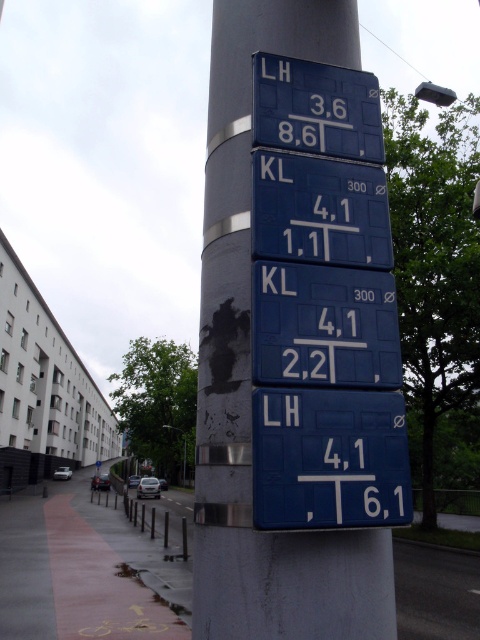
You are a delivery driver who needs to park your truck on the red asphalt pavement at lower left. However, there is a black plastic sign at center nearby. Can you park your truck there without hitting the sign?

The red asphalt pavement at lower left might be wider than black plastic sign at center, so there is a possibility that the truck can park there without hitting the sign, but it depends on the exact width difference.

You are a pedestrian standing on the sidewalk and see the black matte text at lower left and the black plastic sign at center. Which one is positioned more to the left?

The black matte text at lower left is positioned to the left of the black plastic sign at center, so it is more to the left.